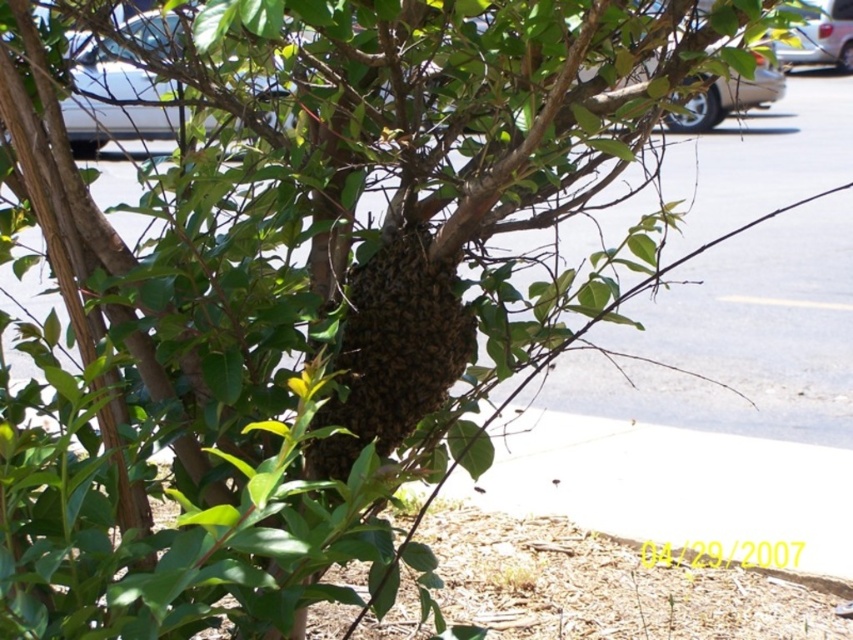
In the scene shown: Between brown fuzzy beehive at center and metallic silver car at upper left, which one has less height?

brown fuzzy beehive at center is shorter.

Does brown fuzzy beehive at center appear under metallic silver car at upper left?

Yes.

You are a GUI agent. You are given a task and a screenshot of the screen. Output one action in this format:
    pyautogui.click(x=<x>, y=<y>)
    Task: Click on the brown fuzzy beehive at center
    This screenshot has width=853, height=640.
    Given the screenshot: What is the action you would take?
    393,349

Locate an element on the screen. brown fuzzy beehive at center is located at coordinates (393, 349).

Which is more to the right, metallic silver car at upper left or metallic gold car at upper center?

metallic gold car at upper center

Where is `metallic silver car at upper left`? The height and width of the screenshot is (640, 853). metallic silver car at upper left is located at coordinates (112, 97).

You are a GUI agent. You are given a task and a screenshot of the screen. Output one action in this format:
    pyautogui.click(x=<x>, y=<y>)
    Task: Click on the metallic silver car at upper left
    
    Given the screenshot: What is the action you would take?
    112,97

Between brown fuzzy beehive at center and metallic gold car at upper center, which one appears on the left side from the viewer's perspective?

brown fuzzy beehive at center is more to the left.

Who is more forward, (x=376, y=264) or (x=755, y=104)?

Point (x=376, y=264)

Is point (380, 310) positioned behind point (747, 93)?

No, it is in front of (747, 93).

Find the location of `brown fuzzy beehive at center`. brown fuzzy beehive at center is located at coordinates (393, 349).